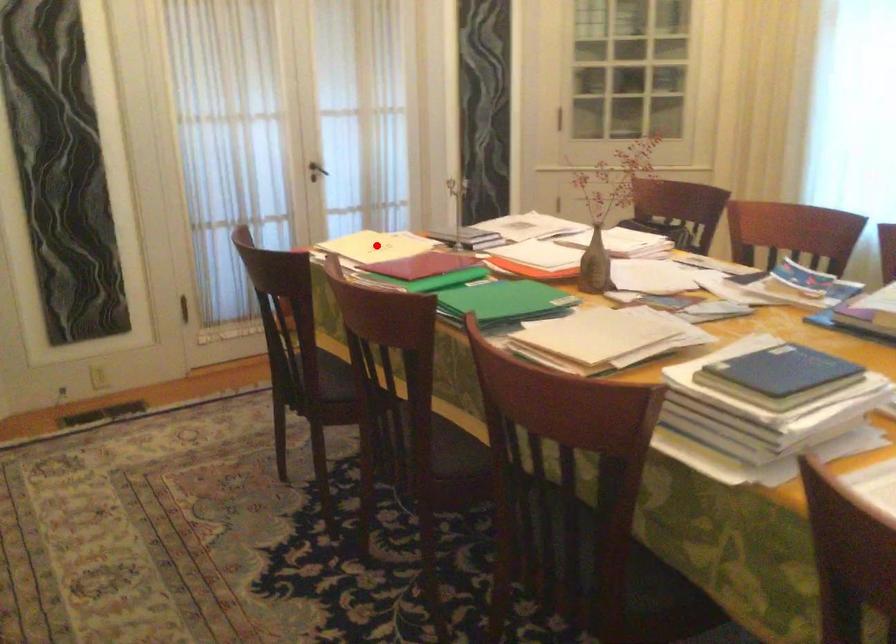
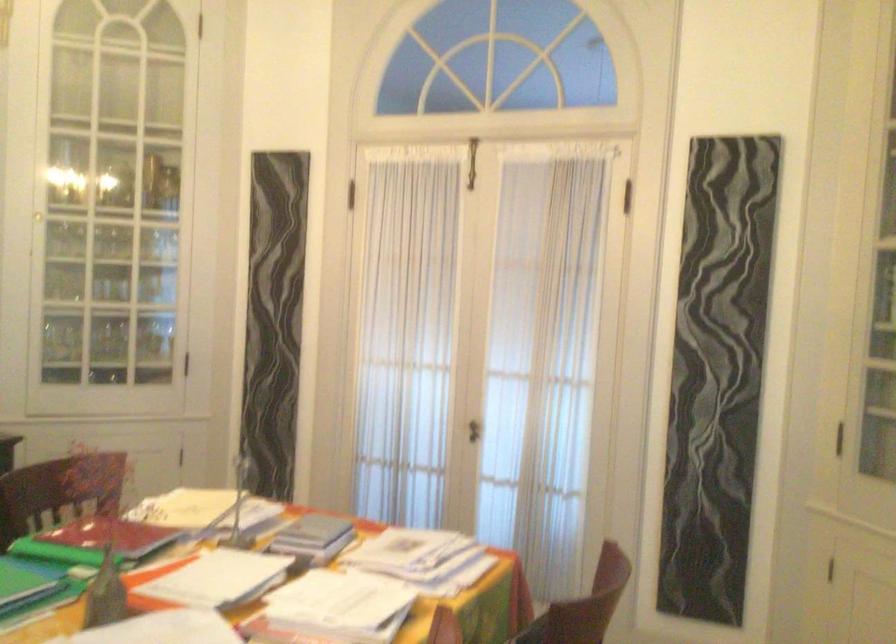
Question: I am providing you with two images of the same scene from different viewpoints. A red point is marked on the first image. At the location where the point appears in image 1, is it still visible in image 2?

Choices:
 (A) Yes
 (B) No

Answer: (B)